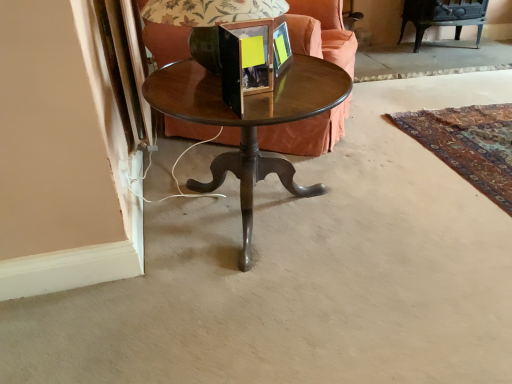
Identify the location of vacant space situated on the left part of wooden picture frame at center, arranged as the 2th picture frame when viewed from the back. (202, 101).